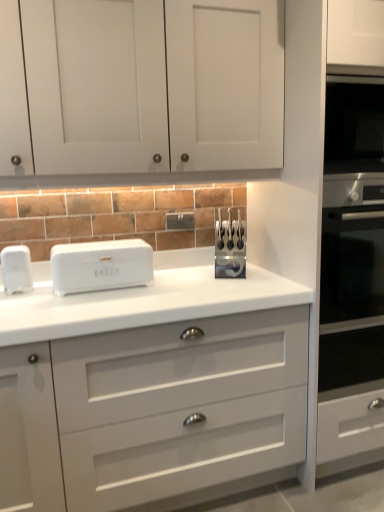
Image resolution: width=384 pixels, height=512 pixels. I want to click on free space in front of white glossy bread bin at center, positioned as the first home appliance in right-to-left order, so click(91, 304).